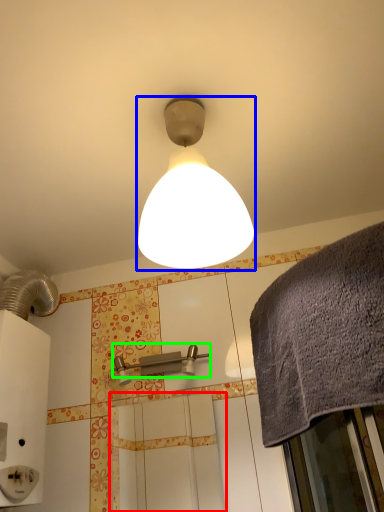
Question: Considering the real-world distances, which object is farthest from screen door (highlighted by a red box)? lamp (highlighted by a blue box) or shower (highlighted by a green box)?

Choices:
 (A) lamp
 (B) shower

Answer: (A)